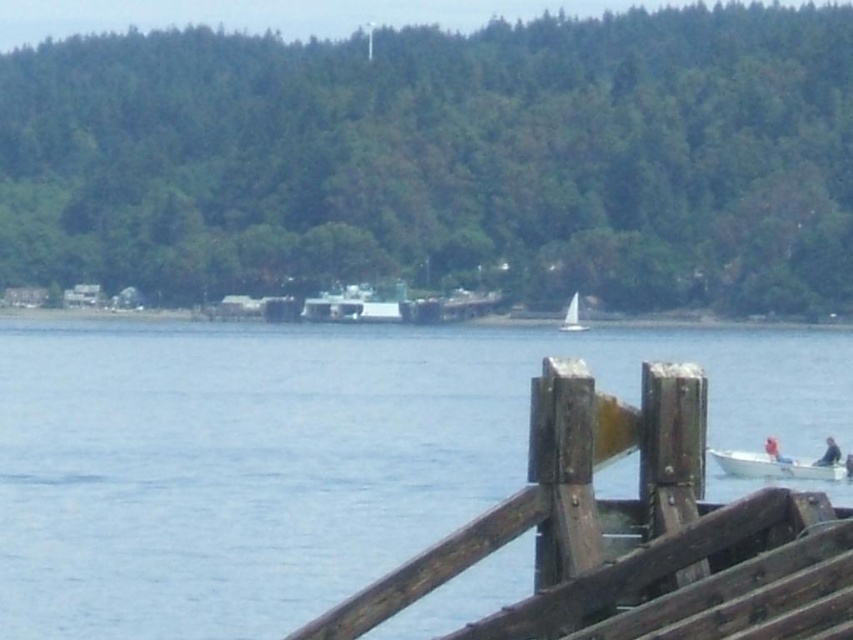
Question: Where is brown wooden dock at lower right located in relation to white sailboat at center in the image?

Choices:
 (A) above
 (B) below

Answer: (B)

Question: Which point is closer to the camera taking this photo?

Choices:
 (A) (566, 324)
 (B) (668, 566)

Answer: (B)

Question: Which object appears closest to the camera in this image?

Choices:
 (A) white sailboat at center
 (B) white plastic boat at lower right
 (C) brown wooden dock at lower right

Answer: (C)

Question: Is brown wooden dock at lower right below white sailboat at center?

Choices:
 (A) no
 (B) yes

Answer: (B)

Question: Considering the relative positions of brown wooden dock at lower right and white plastic boat at lower right in the image provided, where is brown wooden dock at lower right located with respect to white plastic boat at lower right?

Choices:
 (A) left
 (B) right

Answer: (A)

Question: Which of these objects is positioned farthest from the white sailboat at center?

Choices:
 (A) white plastic boat at lower right
 (B) brown wooden dock at lower right

Answer: (B)